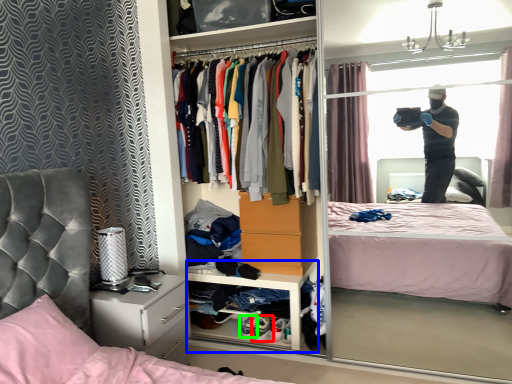
Question: Based on their relative distances, which object is farther from footwear (highlighted by a red box)? Choose from cabinet (highlighted by a blue box) and footwear (highlighted by a green box).

Choices:
 (A) cabinet
 (B) footwear

Answer: (A)